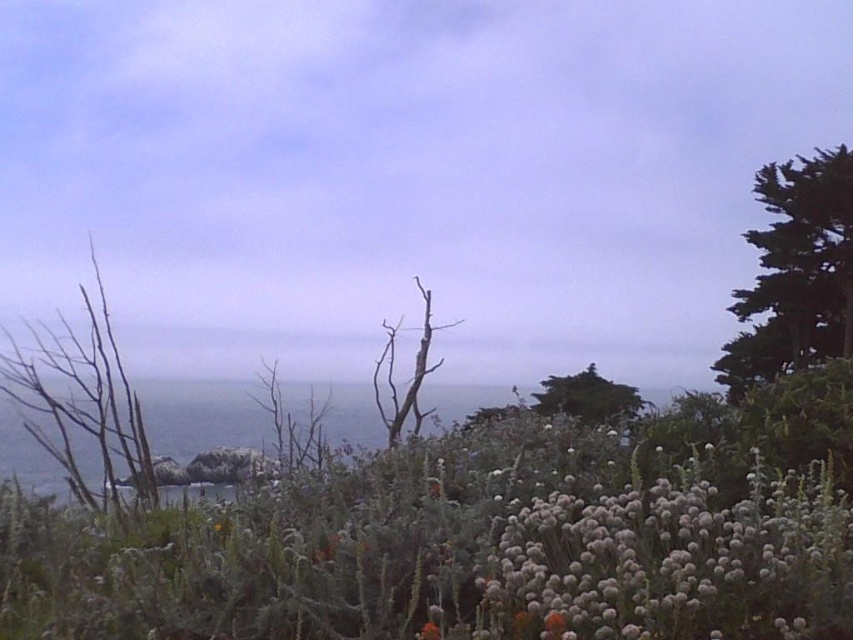
Is point (782, 200) positioned behind point (416, 352)?

Yes, it is.

Between point (828, 339) and point (376, 372), which one is positioned behind?

Positioned behind is point (828, 339).

The image size is (853, 640). Describe the element at coordinates (795, 273) in the screenshot. I see `green leafy tree at upper right` at that location.

The height and width of the screenshot is (640, 853). I want to click on green leafy tree at upper right, so click(795, 273).

Which of these two, green leafy tree at center or bare wood tree at center, stands taller?

Standing taller between the two is bare wood tree at center.

In the scene shown: Can you confirm if green leafy tree at center is smaller than bare wood tree at center?

Actually, green leafy tree at center might be larger than bare wood tree at center.

Who is more forward, (585, 369) or (381, 355)?

Positioned in front is point (381, 355).

At what (x,y) coordinates should I click in order to perform the action: click on green leafy tree at center. Please return your answer as a coordinate pair (x, y). The width and height of the screenshot is (853, 640). Looking at the image, I should click on (587, 397).

Which is in front, point (733, 392) or point (541, 406)?

Point (541, 406) is more forward.

Is green leafy tree at upper right in front of green leafy tree at center?

No, green leafy tree at upper right is further to the viewer.

Identify the location of green leafy tree at upper right. The image size is (853, 640). (795, 273).

Identify the location of green leafy tree at upper right. Image resolution: width=853 pixels, height=640 pixels. pos(795,273).